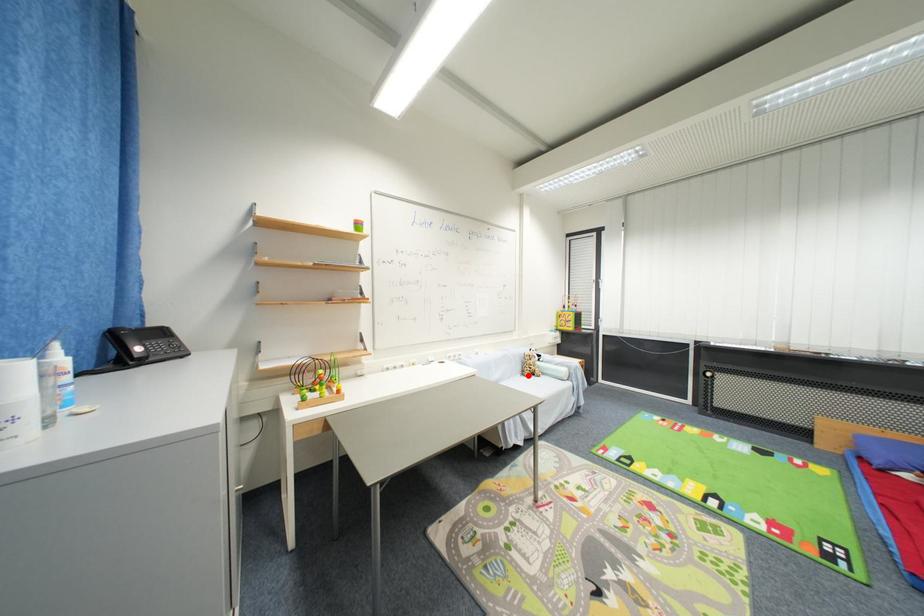
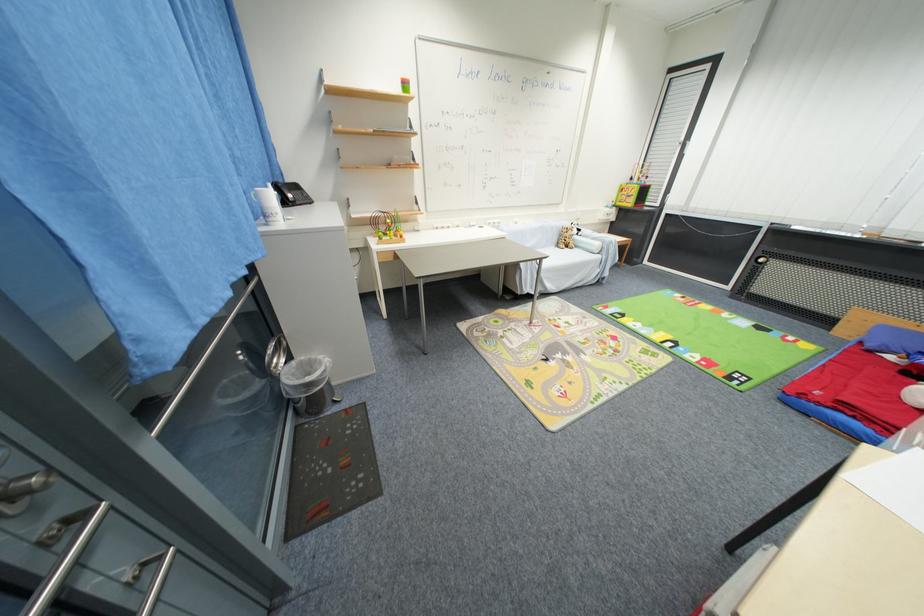
Question: I am providing you with two images of the same scene from different viewpoints. Given a red point in image1, look at the same physical point in image2. Is it:

Choices:
 (A) Closer to the viewpoint
 (B) Farther from the viewpoint

Answer: (B)